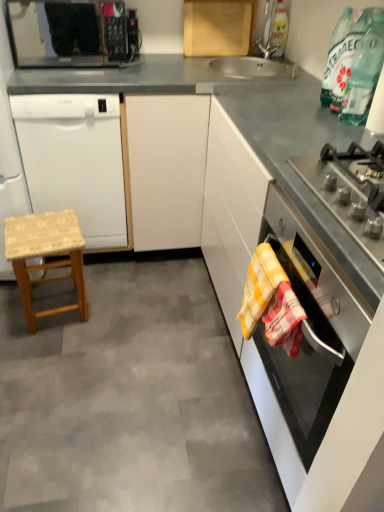
The image size is (384, 512). Find the location of `unoccupied space behind woven wood stool at lower left`. unoccupied space behind woven wood stool at lower left is located at coordinates (x=102, y=273).